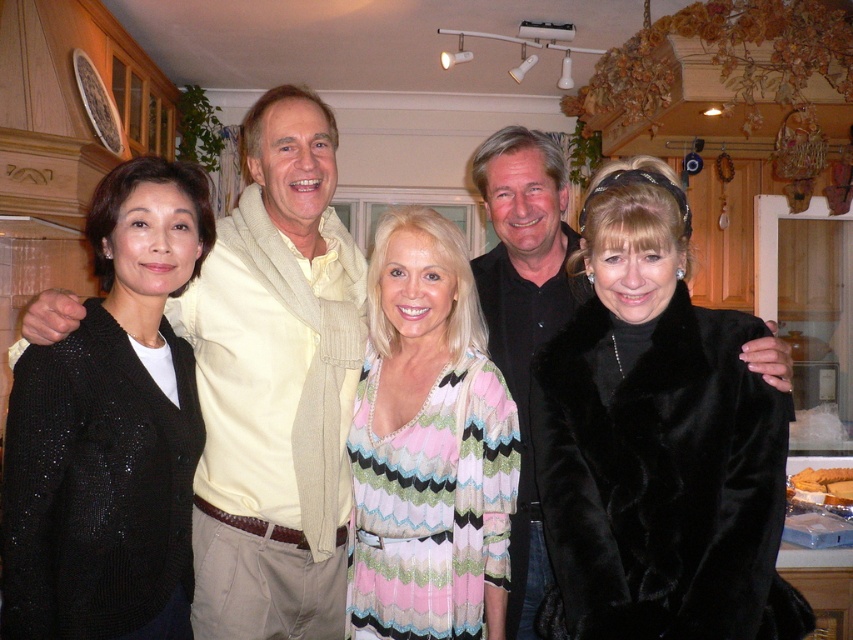
Can you confirm if black fur coat at center is bigger than black velvet shirt at center?

No.

Does black fur coat at center have a greater width compared to black velvet shirt at center?

Yes, black fur coat at center is wider than black velvet shirt at center.

What do you see at coordinates (654, 435) in the screenshot?
I see `black fur coat at center` at bounding box center [654, 435].

Image resolution: width=853 pixels, height=640 pixels. I want to click on black fur coat at center, so click(654, 435).

Does black fur coat at center lie in front of light beige sweater at left?

→ Yes, it is.

Looking at this image, between black fur coat at center and light beige sweater at left, which one has less height?

With less height is black fur coat at center.

Which is in front, point (589, 381) or point (280, 520)?

Point (589, 381) is more forward.

Locate an element on the screen. This screenshot has height=640, width=853. black fur coat at center is located at coordinates (654, 435).

Is point (26, 314) in front of point (126, 529)?

Yes, it is.

From the picture: Who is more forward, [213,388] or [51,566]?

Point [51,566] is in front.

Where is `light beige sweater at left`? This screenshot has width=853, height=640. light beige sweater at left is located at coordinates (276, 384).